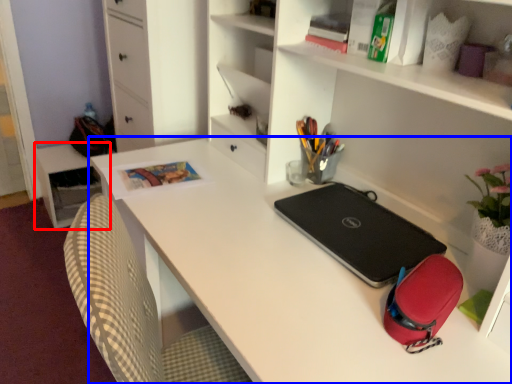
Question: Which object is closer to the camera taking this photo, table (highlighted by a red box) or desk (highlighted by a blue box)?

Choices:
 (A) table
 (B) desk

Answer: (B)